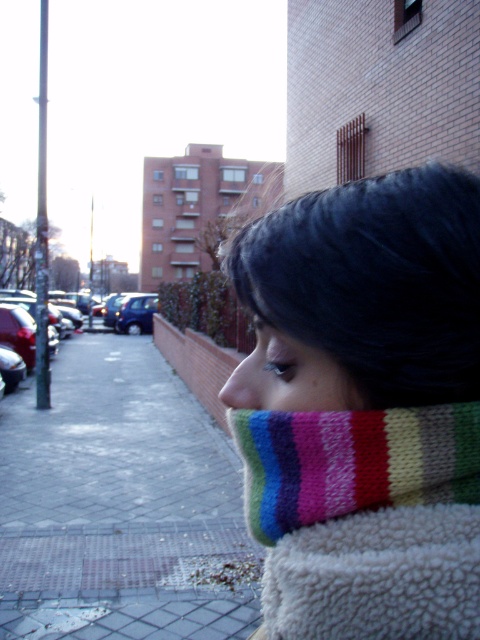
You are a delivery person holding a package and need to place it on the gray brick pavement at lower left while avoiding the knitted multicolor scarf at lower right. Based on the scene description, which direction should you move the package to ensure it lands on the correct surface?

The gray brick pavement at lower left is to the left of the knitted multicolor scarf at lower right, so you should move the package to the left to place it on the gray brick pavement at lower left.

You are a fashion designer observing the scene. You notice the knitted scarf at center and the shiny blue sedan at center. Which object has a smaller width?

The knitted scarf at center has a lesser width compared to the shiny blue sedan at center.

You are standing on the gray brick pavement at lower left and want to reach the knitted multicolor scarf at lower right. Which direction should you move to get there?

The gray brick pavement at lower left is located below the knitted multicolor scarf at lower right, so you should move upward to reach it.